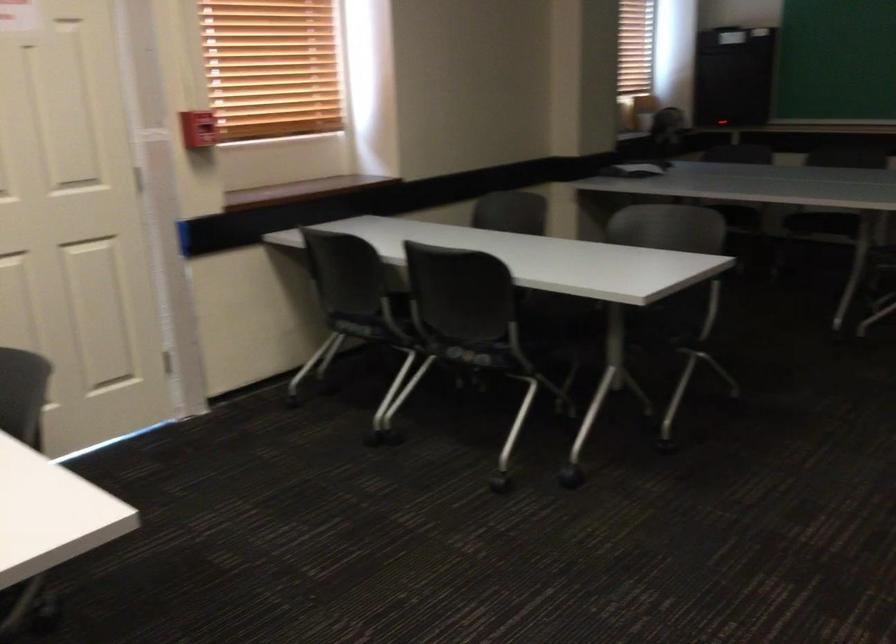
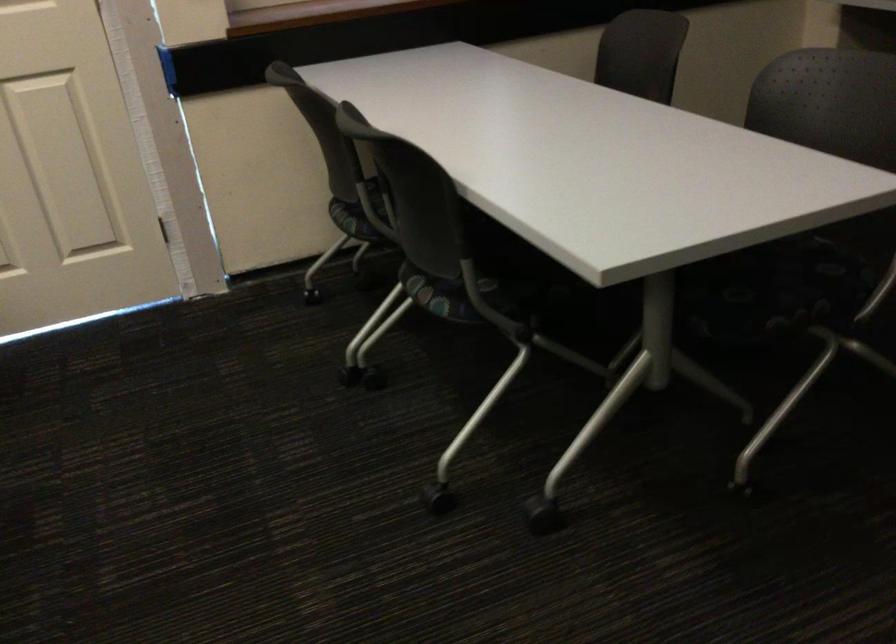
Locate, in the second image, the point that corresponds to (x=477, y=355) in the first image.

(442, 295)